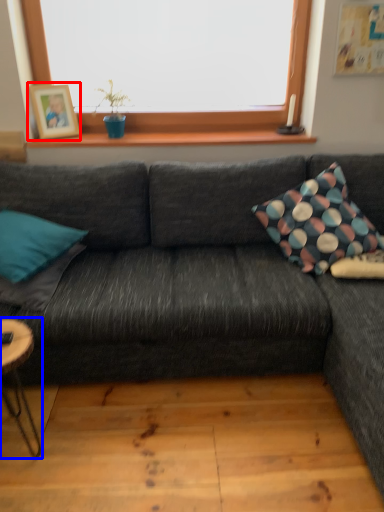
Question: Which object appears farthest to the camera in this image, picture frame (highlighted by a red box) or coffee table (highlighted by a blue box)?

Choices:
 (A) picture frame
 (B) coffee table

Answer: (A)